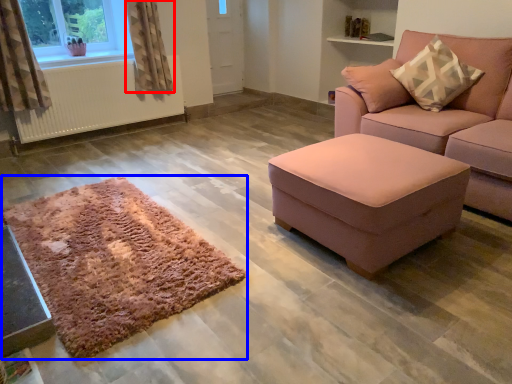
Question: Which object appears farthest to the camera in this image, curtain (highlighted by a red box) or mat (highlighted by a blue box)?

Choices:
 (A) curtain
 (B) mat

Answer: (A)